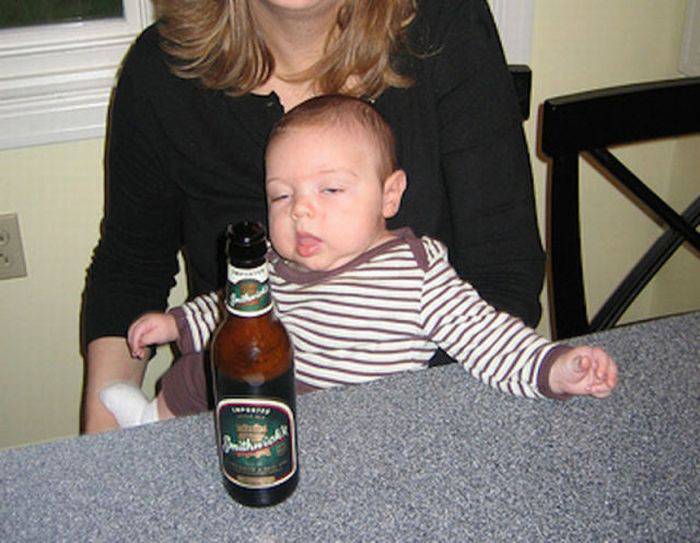
Locate an element on the screen. This screenshot has height=543, width=700. chair is located at coordinates (596, 130).